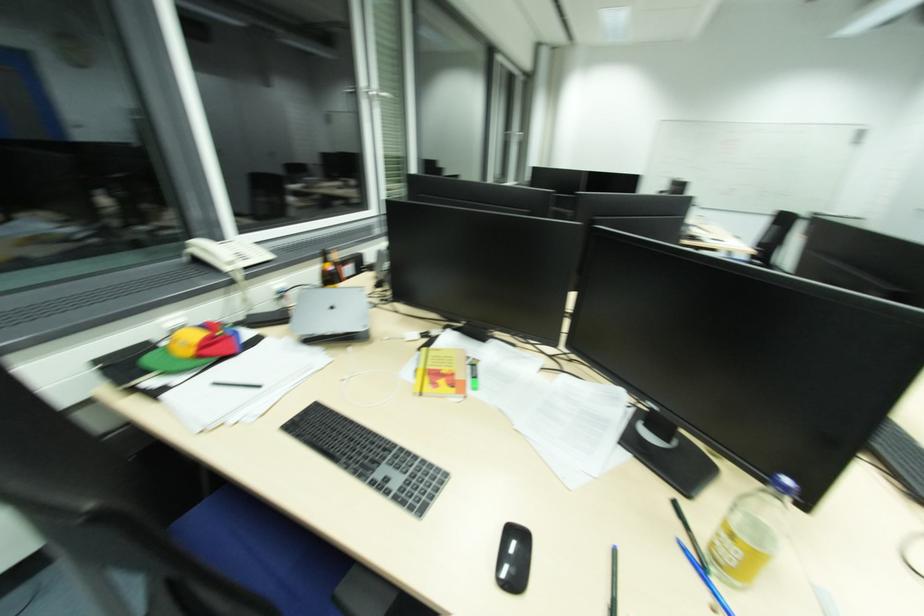
I want to click on blue bottle cap, so click(786, 495).